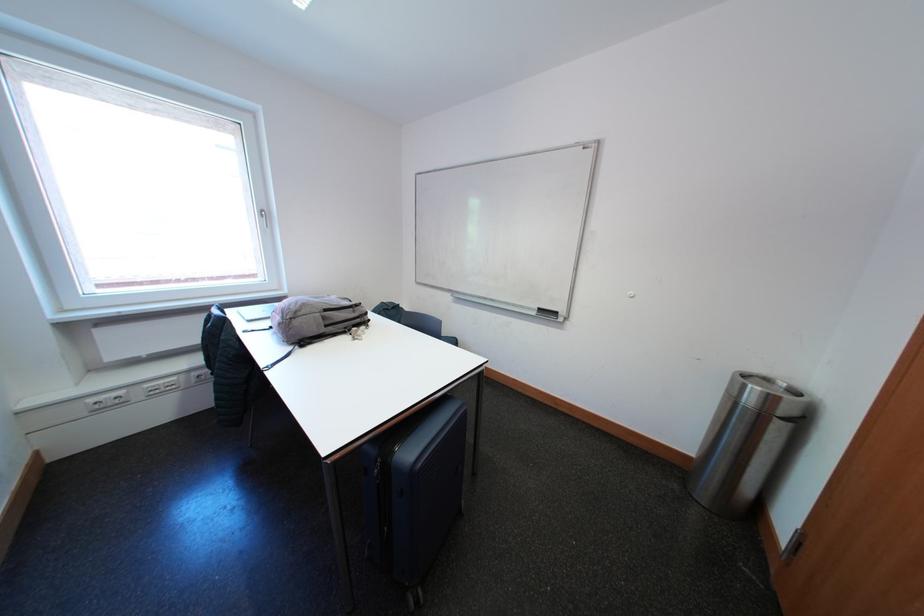
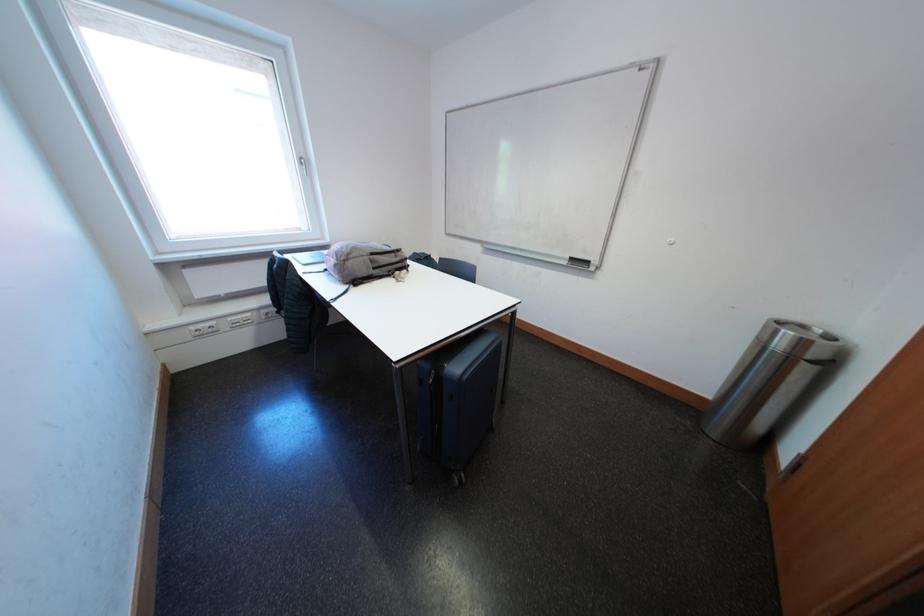
Find the pixel in the second image that matches point (273, 214) in the first image.

(311, 163)